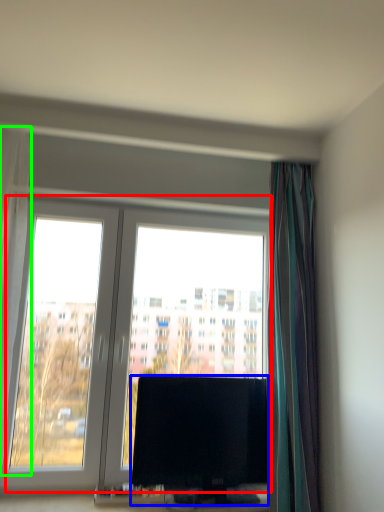
Question: Which object is the closest to the window (highlighted by a red box)? Choose among these: television (highlighted by a blue box) or curtain (highlighted by a green box).

Choices:
 (A) television
 (B) curtain

Answer: (A)